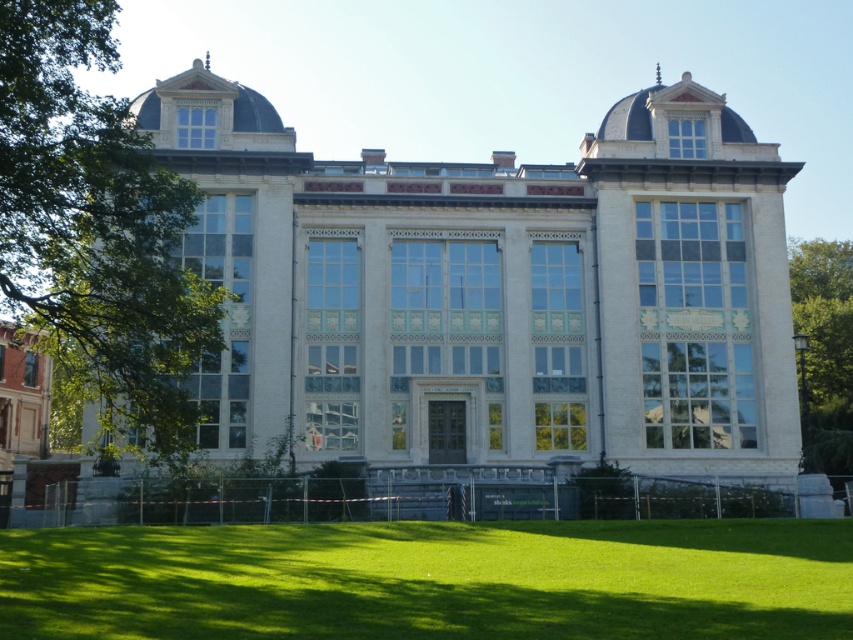
You are standing in front of the grand building and looking at the green grass at lower center and the green leafy tree at left. Which one is nearer to you?

The green grass at lower center is closer to the viewer than the green leafy tree at left.

You are standing in a garden looking at the grand building. You see the green grass at lower center and the green leafy tree at right. Which object is closer to you?

The green grass at lower center is closer to you because it is in front of the green leafy tree at right.